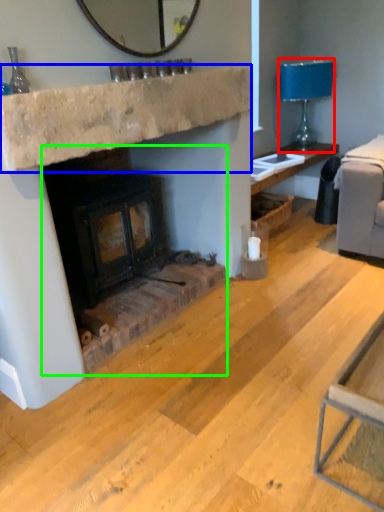
Question: Based on their relative distances, which object is nearer to lamp (highlighted by a red box)? Choose from counter top (highlighted by a blue box) and wood burning stove (highlighted by a green box).

Choices:
 (A) counter top
 (B) wood burning stove

Answer: (A)